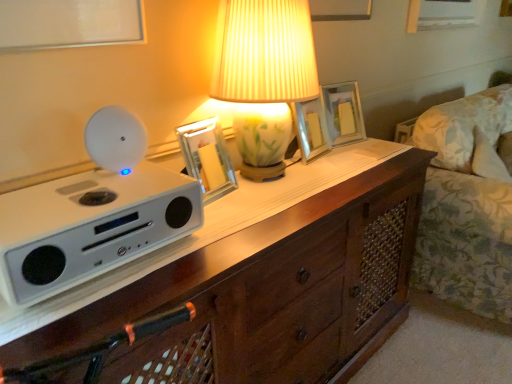
Locate an element on the screen. The height and width of the screenshot is (384, 512). free location to the right of porcelain floral lamp at center is located at coordinates (346, 173).